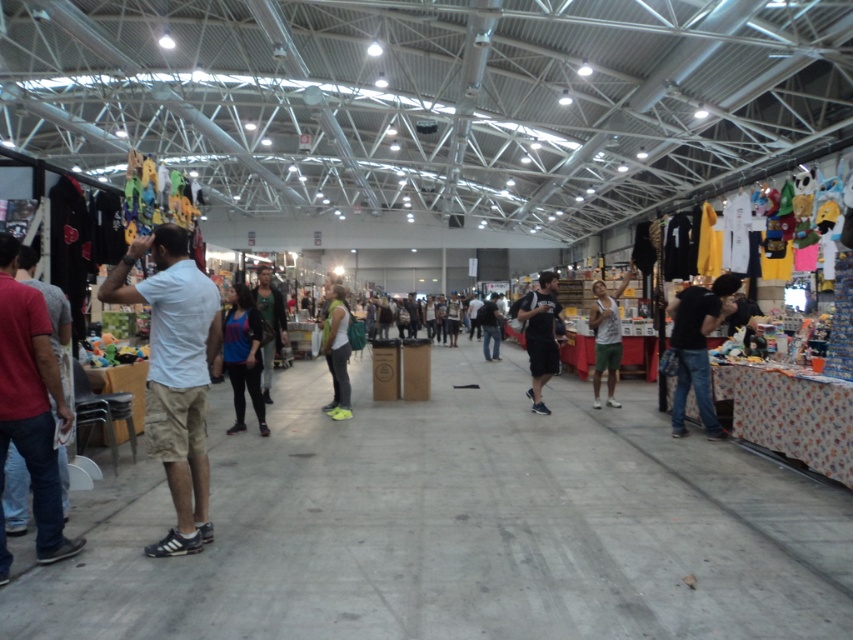
You are at the market and want to carry both the green fabric backpack at center and the leather jacket at center. If you place them side by side on the ground, which one will take up more horizontal space?

The leather jacket at center takes up more horizontal space because it has a greater width than the green fabric backpack at center.

You are at the center of the market and want to pick up the dark gray fabric backpack at center. According to the coordinates provided, is the backpack located to your left, right, front, or directly in front of you?

The dark gray fabric backpack at center is located at coordinates point (540, 336), which places it directly in front of you.